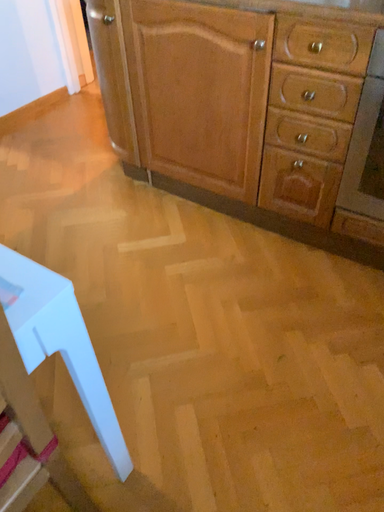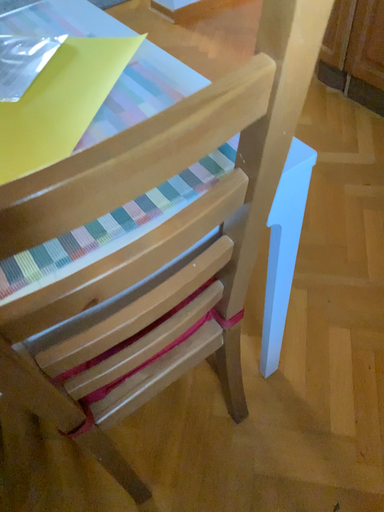
Question: How did the camera likely rotate when shooting the video?

Choices:
 (A) rotated right
 (B) rotated left

Answer: (B)